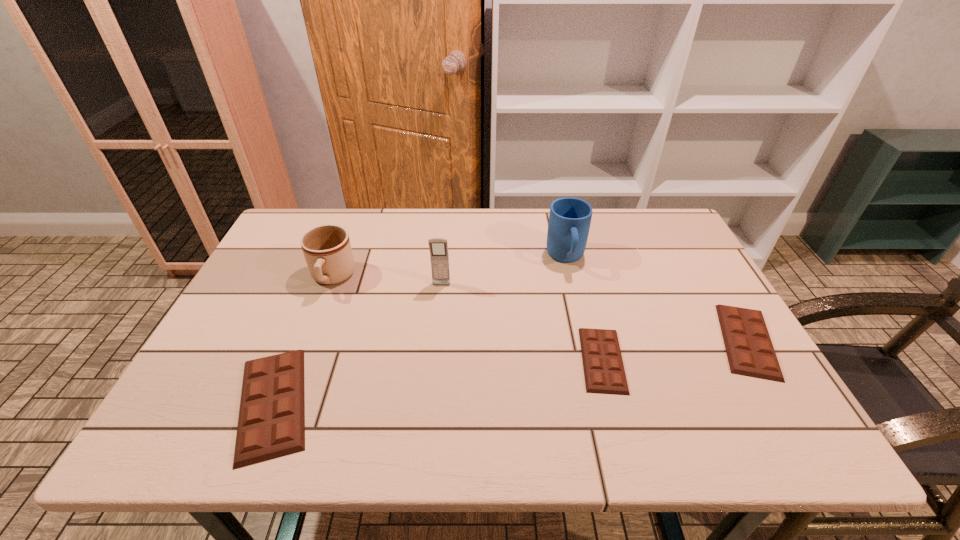
Identify the location of free location at the far edge. This screenshot has width=960, height=540. (445, 217).

Where is `vacant space at the near edge of the desktop`? This screenshot has width=960, height=540. vacant space at the near edge of the desktop is located at coordinates (567, 404).

This screenshot has height=540, width=960. I want to click on free location at the left edge of the desktop, so click(x=265, y=313).

Identify the location of vacant space at the far left corner of the desktop. The width and height of the screenshot is (960, 540). (323, 220).

Find the location of a particular element. The image size is (960, 540). vacant region at the far right corner of the desktop is located at coordinates (668, 241).

Locate an element on the screen. This screenshot has height=540, width=960. free space that is in between the third tallest object and the third object from left to right is located at coordinates (387, 281).

You are a GUI agent. You are given a task and a screenshot of the screen. Output one action in this format:
    pyautogui.click(x=<x>, y=<y>)
    Task: Click on the free space that is in between the right mug and the fourth object from right to left
    The width and height of the screenshot is (960, 540).
    Given the screenshot: What is the action you would take?
    pyautogui.click(x=504, y=272)

This screenshot has width=960, height=540. What are the coordinates of `vacant area that lies between the third object from left to right and the second tallest chocolate bar` in the screenshot? It's located at (594, 313).

Where is `free space between the fourth shortest object and the leftmost chocolate bar`? The height and width of the screenshot is (540, 960). free space between the fourth shortest object and the leftmost chocolate bar is located at coordinates (302, 341).

Locate an element on the screen. empty location between the right mug and the third tallest object is located at coordinates (449, 268).